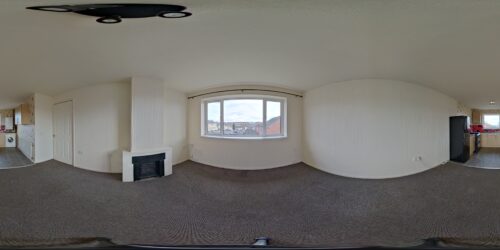
Image resolution: width=500 pixels, height=250 pixels. Identify the location of 3 panel picture window in center. (241, 114), (208, 114), (281, 114).